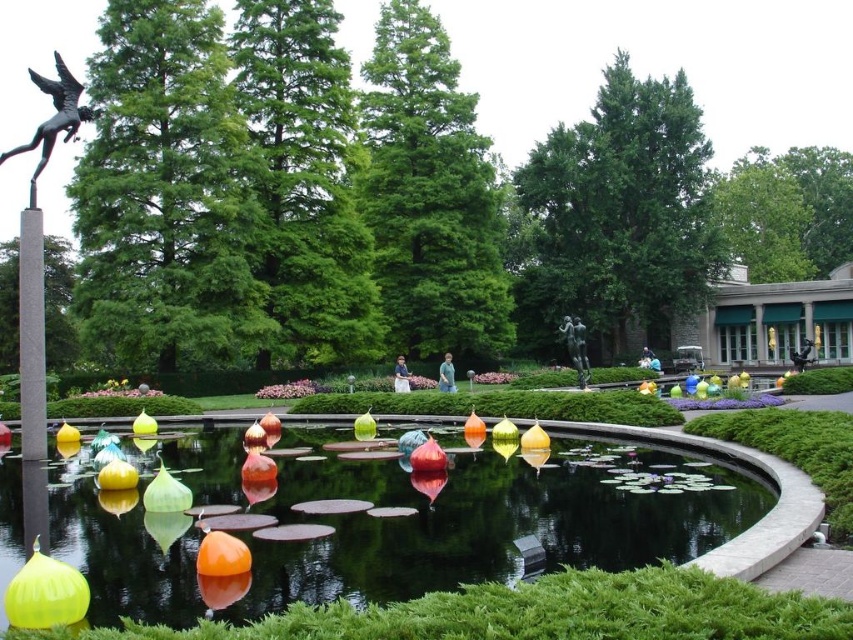
Between translucent glass pond at center and polished bronze bird at upper left, which one is positioned higher?

polished bronze bird at upper left

Who is positioned more to the left, translucent glass pond at center or polished bronze bird at upper left?

polished bronze bird at upper left

Who is more distant from viewer, (56, 528) or (90, 108)?

Positioned behind is point (90, 108).

Find the location of `translucent glass pond at center`. translucent glass pond at center is located at coordinates (491, 520).

Between point (704, 477) and point (567, 337), which one is positioned in front?

Positioned in front is point (704, 477).

Is point (480, 490) positioned behind point (570, 353)?

No, it is in front of (570, 353).

The image size is (853, 640). What do you see at coordinates (491, 520) in the screenshot?
I see `translucent glass pond at center` at bounding box center [491, 520].

Find the location of a particular element. This screenshot has height=640, width=853. translucent glass pond at center is located at coordinates (491, 520).

This screenshot has height=640, width=853. What do you see at coordinates (54, 115) in the screenshot? I see `polished bronze bird at upper left` at bounding box center [54, 115].

Does polished bronze bird at upper left appear under bronze statue at center?

No.

This screenshot has width=853, height=640. What do you see at coordinates (54, 115) in the screenshot?
I see `polished bronze bird at upper left` at bounding box center [54, 115].

Find the location of a particular element. Image resolution: width=853 pixels, height=640 pixels. polished bronze bird at upper left is located at coordinates (54, 115).